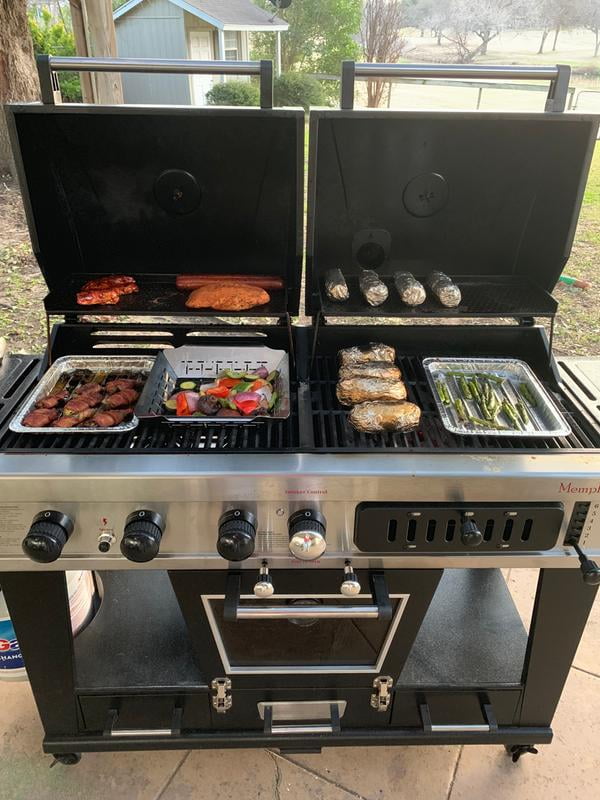
Where is `knob`? knob is located at coordinates (49, 545).